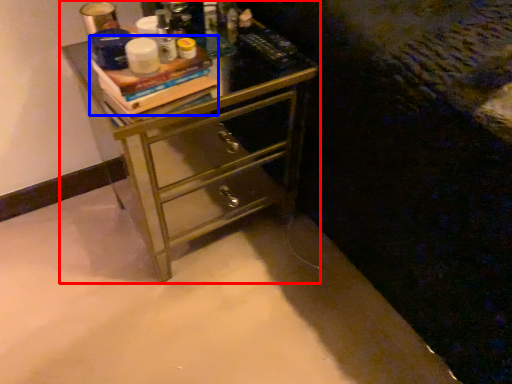
Question: Which object appears farthest to the camera in this image, chest of drawers (highlighted by a red box) or book (highlighted by a blue box)?

Choices:
 (A) chest of drawers
 (B) book

Answer: (A)